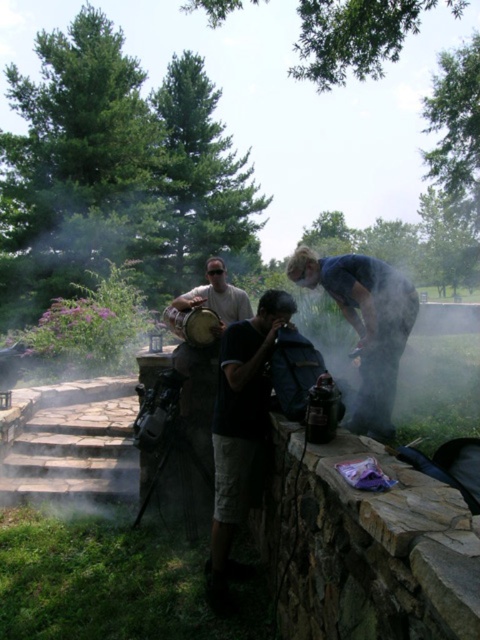
Is blue denim shirt at center to the right of matte brown shirt at center from the viewer's perspective?

Correct, you'll find blue denim shirt at center to the right of matte brown shirt at center.

Who is lower down, blue denim shirt at center or matte brown shirt at center?

blue denim shirt at center is below.

Image resolution: width=480 pixels, height=640 pixels. What are the coordinates of `blue denim shirt at center` in the screenshot? It's located at (365, 324).

Where is `blue denim shirt at center`? blue denim shirt at center is located at coordinates (365, 324).

Does dark blue shirt at center have a greater height compared to matte brown shirt at center?

Yes.

Between dark blue shirt at center and matte brown shirt at center, which one is positioned lower?

dark blue shirt at center is below.

Where is `dark blue shirt at center`? dark blue shirt at center is located at coordinates (240, 419).

Is dark blue shirt at center smaller than blue denim shirt at center?

Actually, dark blue shirt at center might be larger than blue denim shirt at center.

Is dark blue shirt at center to the left of blue denim shirt at center from the viewer's perspective?

Indeed, dark blue shirt at center is positioned on the left side of blue denim shirt at center.

Image resolution: width=480 pixels, height=640 pixels. Identify the location of dark blue shirt at center. (240, 419).

The width and height of the screenshot is (480, 640). Find the location of `dark blue shirt at center`. dark blue shirt at center is located at coordinates (240, 419).